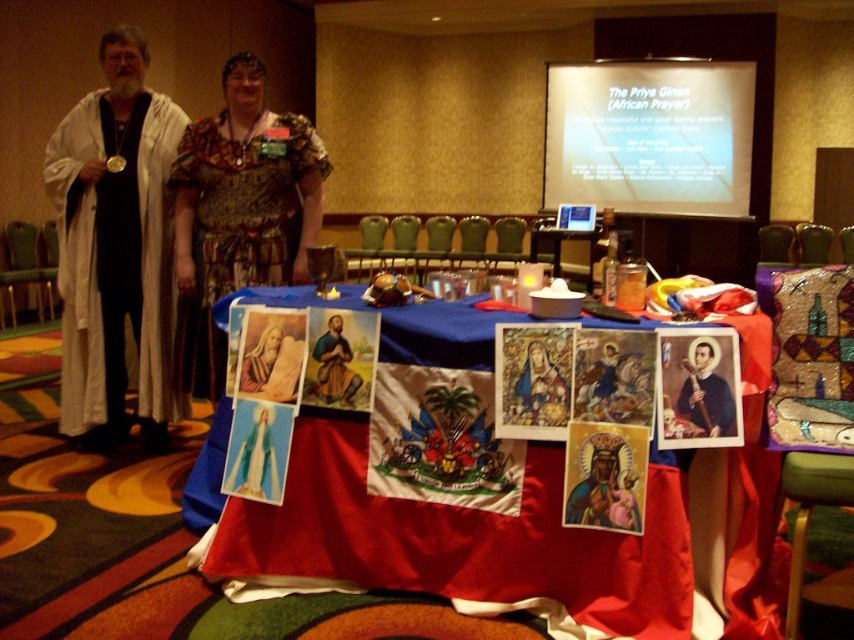
You are organizing a presentation and need to adjust the lighting. You see the white cloth at left and the white glossy projector screen at upper center. Which object is positioned to the left of the other?

The white cloth at left is to the left of the white glossy projector screen at upper center.

You are organizing a presentation and need to decide which item can cover a wider area between the white cloth at left and the white glossy projector screen at upper center. Which one would you choose?

The white glossy projector screen at upper center is wider than the white cloth at left, so it can cover a wider area.

You are organizing a small event in this room and need to place a 6.5 feet long table between the white cloth at left and the matte stained glass at center. Will there be enough space?

The distance between the white cloth at left and the matte stained glass at center is 6.57 feet. Since the table is 6.5 feet long, there will be enough space to place it between them with a small amount of room to spare.